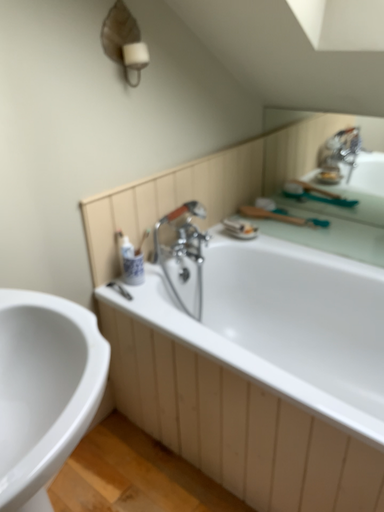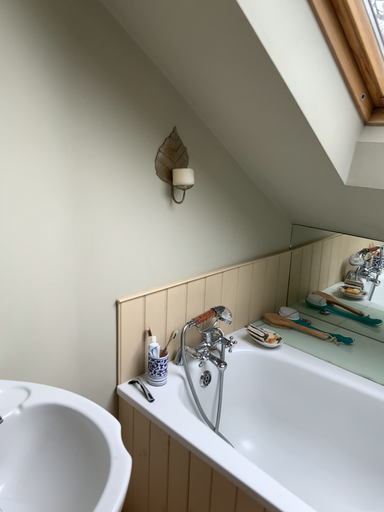
Question: Which way did the camera rotate in the video?

Choices:
 (A) rotated downward
 (B) rotated upward

Answer: (B)